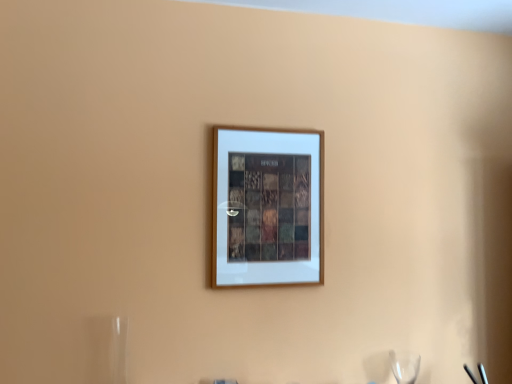
Question: Are transparent glass wine glass at lower right and wooden picture frame at center located far from each other?

Choices:
 (A) yes
 (B) no

Answer: (B)

Question: From the image's perspective, does transparent glass wine glass at lower right appear higher than wooden picture frame at center?

Choices:
 (A) yes
 (B) no

Answer: (B)

Question: Is transparent glass wine glass at lower right positioned behind wooden picture frame at center?

Choices:
 (A) no
 (B) yes

Answer: (B)

Question: Considering the relative sizes of transparent glass wine glass at lower right and wooden picture frame at center in the image provided, is transparent glass wine glass at lower right taller than wooden picture frame at center?

Choices:
 (A) no
 (B) yes

Answer: (A)

Question: Can you confirm if transparent glass wine glass at lower right is positioned to the left of wooden picture frame at center?

Choices:
 (A) no
 (B) yes

Answer: (A)

Question: From a real-world perspective, is transparent glass wine glass at lower right under wooden picture frame at center?

Choices:
 (A) no
 (B) yes

Answer: (B)

Question: Could you tell me if wooden picture frame at center is turned towards transparent glass wine glass at lower right?

Choices:
 (A) yes
 (B) no

Answer: (B)

Question: Does wooden picture frame at center have a greater width compared to transparent glass wine glass at lower right?

Choices:
 (A) yes
 (B) no

Answer: (B)

Question: Does wooden picture frame at center have a smaller size compared to transparent glass wine glass at lower right?

Choices:
 (A) no
 (B) yes

Answer: (A)

Question: Would you consider wooden picture frame at center to be distant from transparent glass wine glass at lower right?

Choices:
 (A) yes
 (B) no

Answer: (B)

Question: Is wooden picture frame at center closer to camera compared to transparent glass wine glass at lower right?

Choices:
 (A) no
 (B) yes

Answer: (B)

Question: Does wooden picture frame at center lie behind transparent glass wine glass at lower right?

Choices:
 (A) yes
 (B) no

Answer: (B)

Question: Is transparent glass wine glass at lower right inside or outside of wooden picture frame at center?

Choices:
 (A) outside
 (B) inside

Answer: (A)